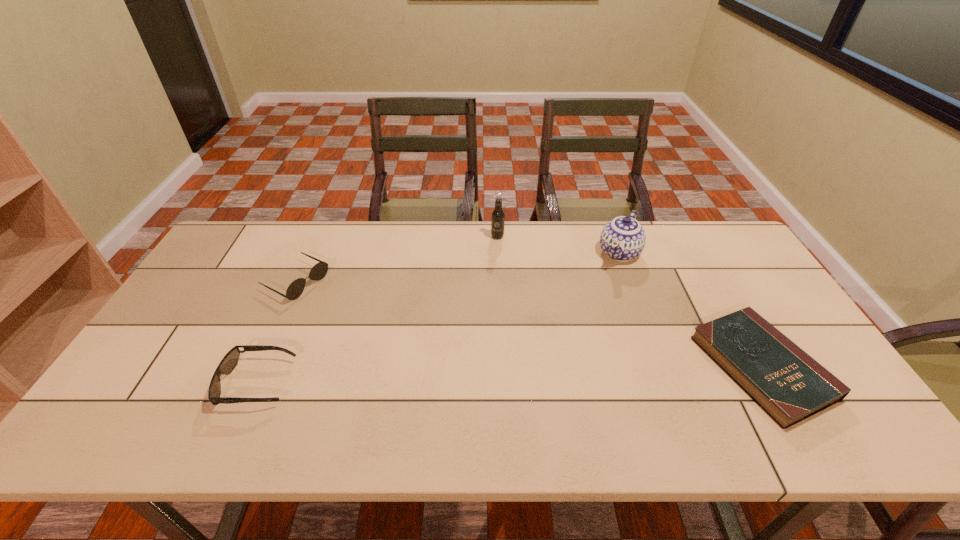
This screenshot has width=960, height=540. What are the coordinates of `vacant space positioned 0.090m on the front-facing side of the fourth tallest object` in the screenshot? It's located at (328, 383).

Find the location of `vacant region located at the spout of the chinaware`. vacant region located at the spout of the chinaware is located at coordinates (574, 339).

Locate an element on the screen. This screenshot has width=960, height=540. vacant point located 0.310m at the spout of the chinaware is located at coordinates (577, 334).

The image size is (960, 540). In order to click on free point located at the spout of the chinaware in this screenshot , I will do `click(602, 291)`.

Where is `blank area located 0.370m on the label of the tallest object`? blank area located 0.370m on the label of the tallest object is located at coordinates (497, 321).

This screenshot has height=540, width=960. Identify the location of free location located on the label of the tallest object. (497, 289).

In order to click on free space located on the label of the tallest object in this screenshot , I will do `click(497, 315)`.

This screenshot has height=540, width=960. What are the coordinates of `free space located on the front-facing side of the taller sunglasses` in the screenshot? It's located at (373, 323).

I want to click on vacant area situated 0.200m on the front-facing side of the taller sunglasses, so click(369, 320).

Locate an element on the screen. vacant point located 0.400m on the front-facing side of the taller sunglasses is located at coordinates (425, 350).